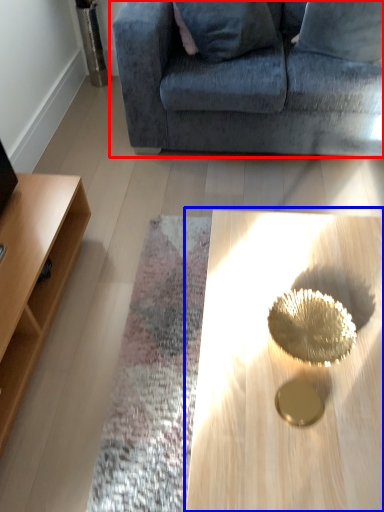
Question: Which object is closer to the camera taking this photo, studio couch (highlighted by a red box) or coffee table (highlighted by a blue box)?

Choices:
 (A) studio couch
 (B) coffee table

Answer: (B)